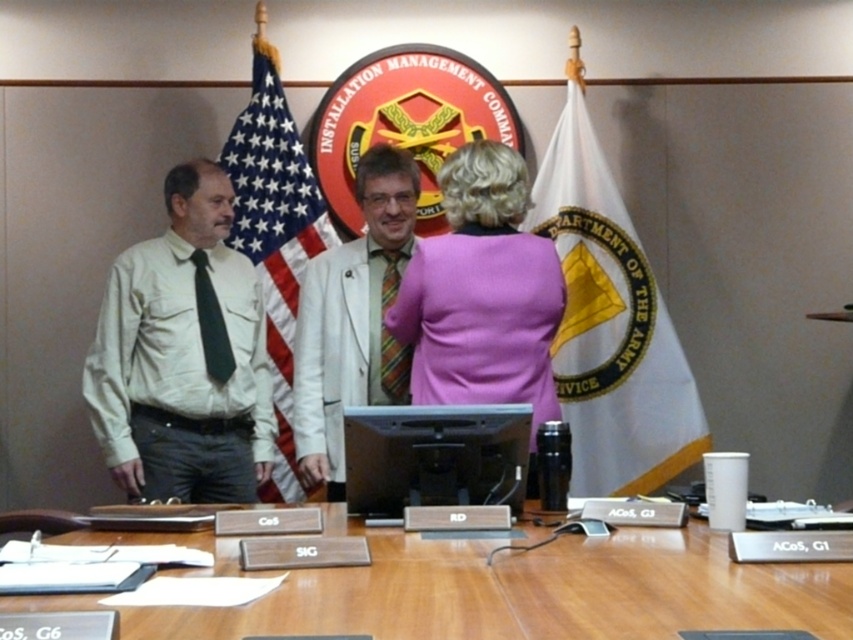
You are an interior designer planning to place a new rectangular desk in this room. The desk you have chosen is the same size as the matte khaki shirt at left. Based on the scene, will the wooden table at center be able to accommodate the new desk in terms of width?

The wooden table at center has a width larger than the matte khaki shirt at left, so yes, the wooden table at center can accommodate the new desk since it is wider than the desk.

You are an observer in the room where the formal meeting is taking place. You notice the white fabric flag at center and the purple fabric coat at center. Which object is closer to you?

The white fabric flag at center is closer to you because the purple fabric coat at center is behind it.

Based on the scene description, which flag is placed higher between the white fabric flag at center and the american flag at center?

The american flag at center is placed higher because the white fabric flag at center is positioned under it.